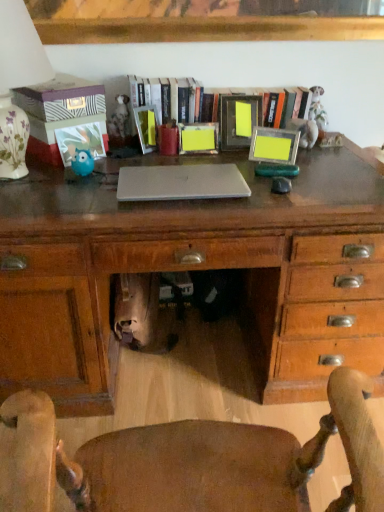
This screenshot has width=384, height=512. Find the location of `free location in front of matte plastic picture frame at upper center, positioned as the fourth picture frame in right-to-left order`. free location in front of matte plastic picture frame at upper center, positioned as the fourth picture frame in right-to-left order is located at coordinates (140, 161).